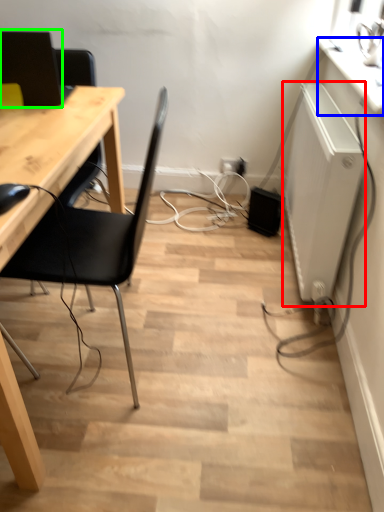
Question: Which object is positioned farthest from appliance (highlighted by a red box)? Select from counter top (highlighted by a blue box) and computer monitor (highlighted by a green box).

Choices:
 (A) counter top
 (B) computer monitor

Answer: (B)